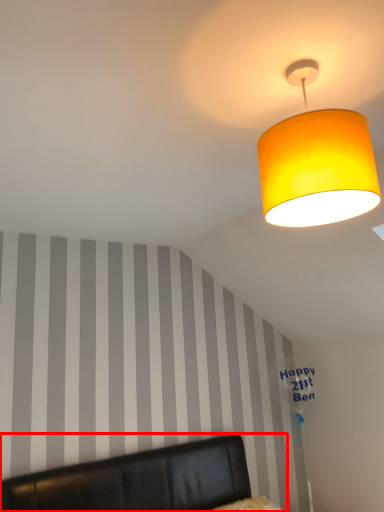
Question: From the image, what is the correct spatial relationship of furniture (annotated by the red box) in relation to lamp?

Choices:
 (A) right
 (B) left

Answer: (B)